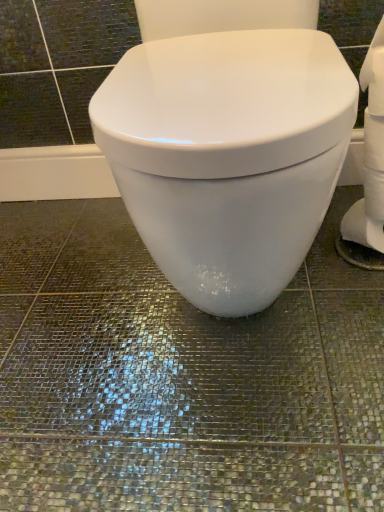
Question: Considering the relative positions of white glossy toilet at center and white matte toilet paper at right in the image provided, is white glossy toilet at center to the left or to the right of white matte toilet paper at right?

Choices:
 (A) right
 (B) left

Answer: (B)

Question: Considering the positions of white glossy toilet at center and white matte toilet paper at right in the image, is white glossy toilet at center wider or thinner than white matte toilet paper at right?

Choices:
 (A) thin
 (B) wide

Answer: (B)

Question: Relative to white matte toilet paper at right, is white glossy toilet at center in front or behind?

Choices:
 (A) behind
 (B) front

Answer: (B)

Question: From the image's perspective, is white matte toilet paper at right located above or below white glossy toilet at center?

Choices:
 (A) above
 (B) below

Answer: (B)

Question: From a real-world perspective, relative to white glossy toilet at center, is white matte toilet paper at right vertically above or below?

Choices:
 (A) below
 (B) above

Answer: (A)

Question: Is white matte toilet paper at right inside the boundaries of white glossy toilet at center, or outside?

Choices:
 (A) outside
 (B) inside

Answer: (A)

Question: In terms of height, does white matte toilet paper at right look taller or shorter compared to white glossy toilet at center?

Choices:
 (A) tall
 (B) short

Answer: (B)